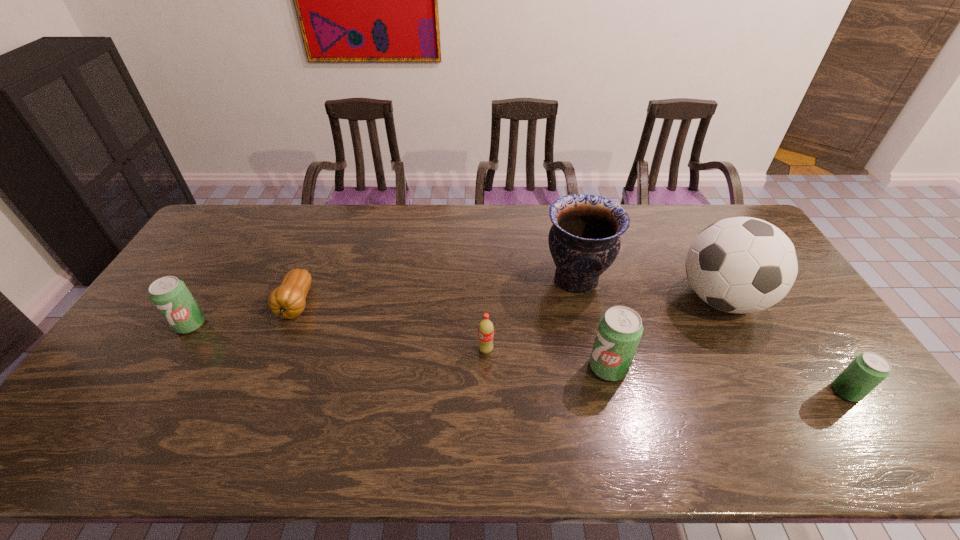
If equal spacing is the goal by inserting an additional pop_(soda) among them, please point out a vacant space for this new pop_(soda). Please provide its 2D coordinates. Your answer should be formatted as a tuple, i.e. [(x, y)], where the tuple contains the x and y coordinates of a point satisfying the conditions above.

[(390, 345)]